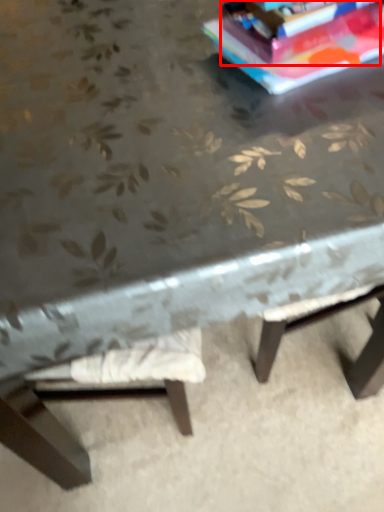
Question: From the image's perspective, considering the relative positions of paperback book (annotated by the red box) and concrete in the image provided, where is paperback book (annotated by the red box) located with respect to the staircase?

Choices:
 (A) above
 (B) below

Answer: (A)